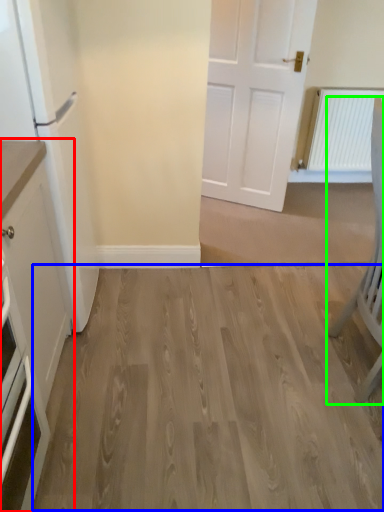
Question: Which object is the farthest from cabinetry (highlighted by a red box)? Choose among these: hardwood (highlighted by a blue box) or chair (highlighted by a green box).

Choices:
 (A) hardwood
 (B) chair

Answer: (B)